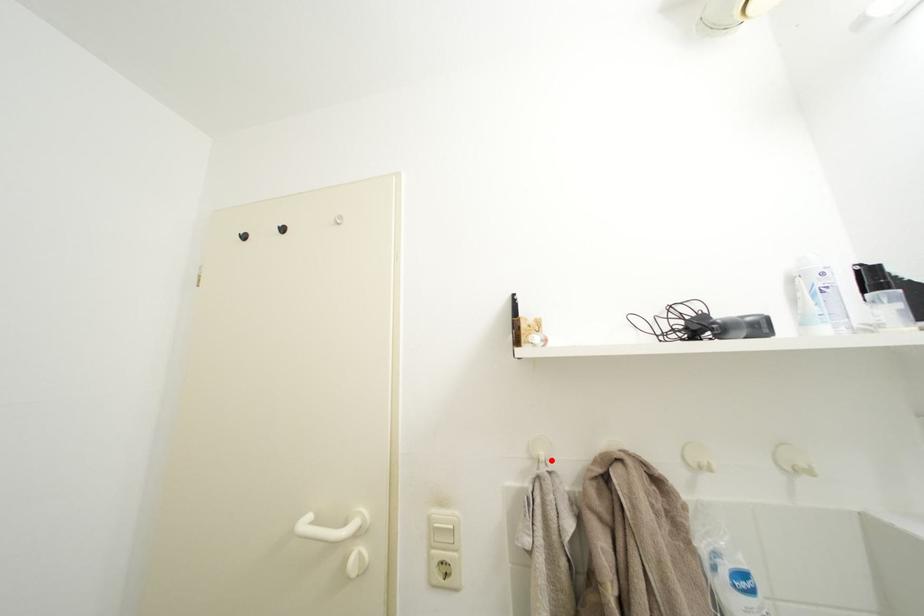
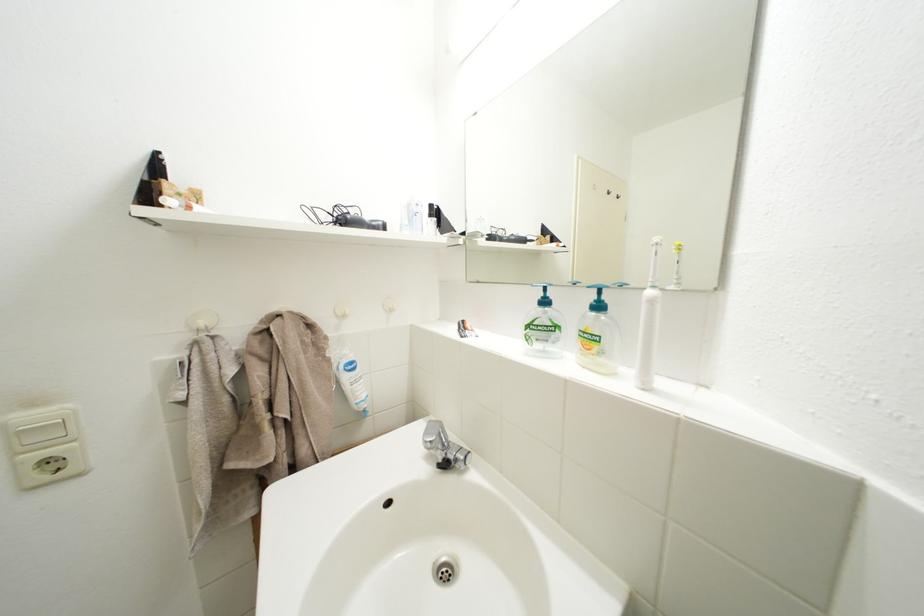
Question: I am providing you with two images of the same scene from different viewpoints. A red point is marked on the first image. At the location where the point appears in image 1, is it still visible in image 2?

Choices:
 (A) Yes
 (B) No

Answer: (A)